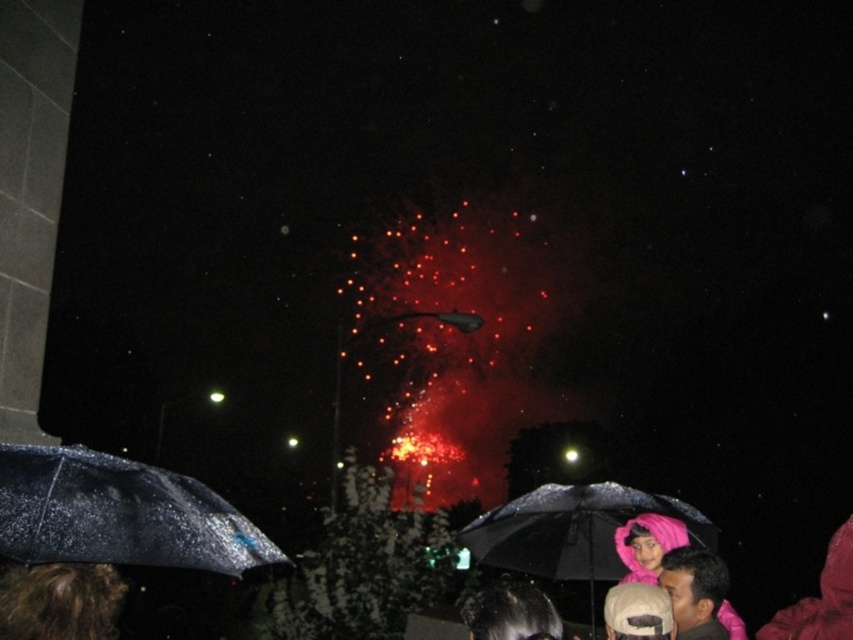
Does black matte umbrella at lower center have a greater width compared to brown curly hair at lower left?

Incorrect, black matte umbrella at lower center's width does not surpass brown curly hair at lower left's.

Does point (566, 566) lie in front of point (27, 592)?

No, (566, 566) is further to viewer.

This screenshot has width=853, height=640. What are the coordinates of `black matte umbrella at lower center` in the screenshot? It's located at (572, 531).

Which is below, transparent wet umbrella at lower left or brown curly hair at lower left?

Positioned lower is brown curly hair at lower left.

This screenshot has width=853, height=640. Describe the element at coordinates (119, 513) in the screenshot. I see `transparent wet umbrella at lower left` at that location.

Between point (103, 472) and point (7, 611), which one is positioned behind?

The point (103, 472) is more distant.

Image resolution: width=853 pixels, height=640 pixels. Find the location of `transparent wet umbrella at lower left`. transparent wet umbrella at lower left is located at coordinates (119, 513).

Is transparent wet umbrella at lower left shorter than black matte umbrella at lower center?

In fact, transparent wet umbrella at lower left may be taller than black matte umbrella at lower center.

Which of these two, transparent wet umbrella at lower left or black matte umbrella at lower center, stands taller?

With more height is transparent wet umbrella at lower left.

What do you see at coordinates (119, 513) in the screenshot?
I see `transparent wet umbrella at lower left` at bounding box center [119, 513].

In order to click on transparent wet umbrella at lower left in this screenshot , I will do `click(119, 513)`.